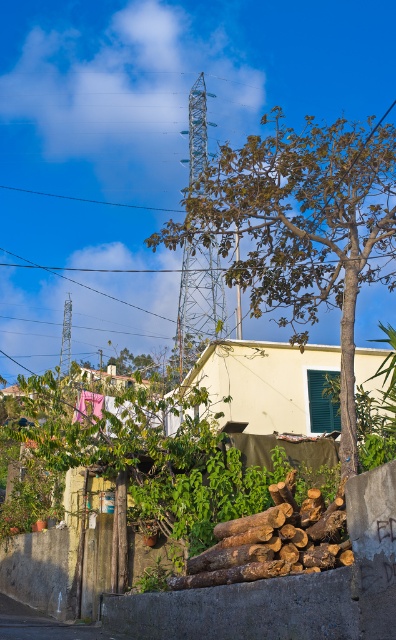
You are standing in the residential area and see the brown leafy tree at center and the natural brown wood at center. Which one is positioned to the right?

The brown leafy tree at center is positioned to the right of the natural brown wood at center.

What are the coordinates of the brown leafy tree at center?

The brown leafy tree at center is located at point (302, 227).

You are standing in the residential area and want to know which object at the center has a greater width between the brown leafy tree at center and the natural brown wood at center. Which one is wider?

The brown leafy tree at center is wider than the natural brown wood at center according to the description.